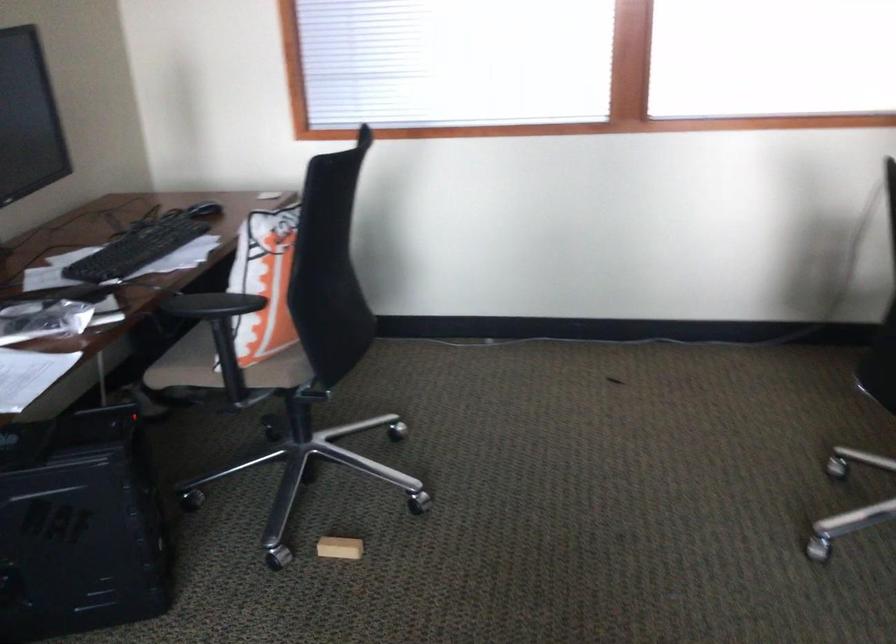
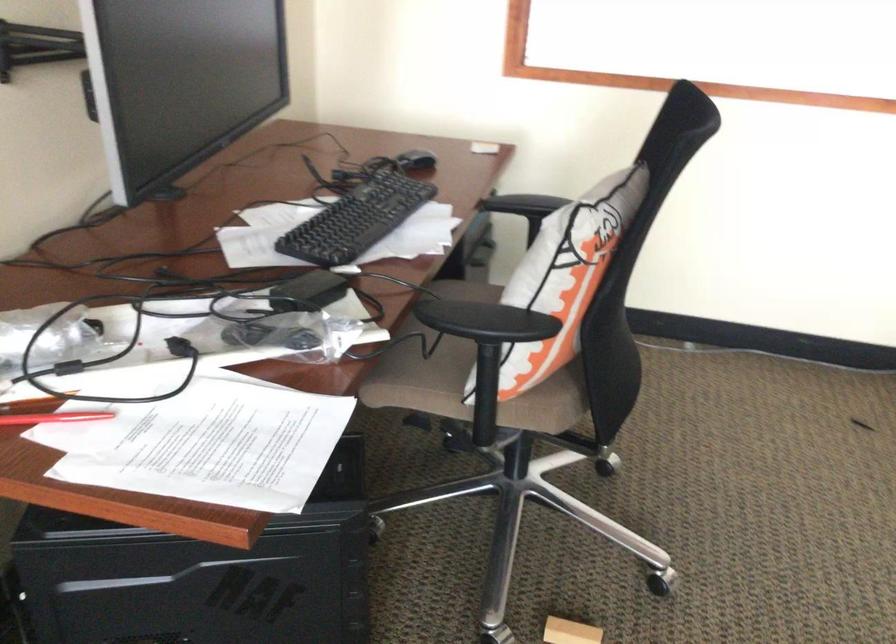
Find the pixel in the second image that matches point 332,545 in the first image.

(570, 632)